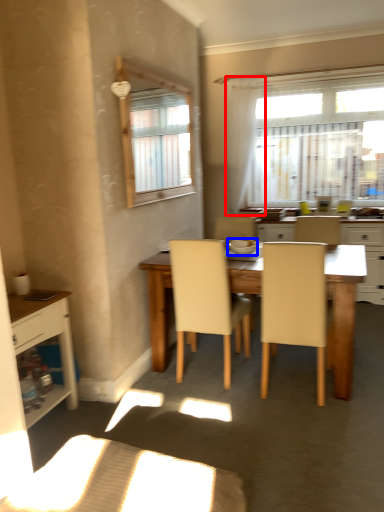
Question: Which point is closer to the camera, curtain (highlighted by a red box) or tableware (highlighted by a blue box)?

Choices:
 (A) curtain
 (B) tableware

Answer: (B)